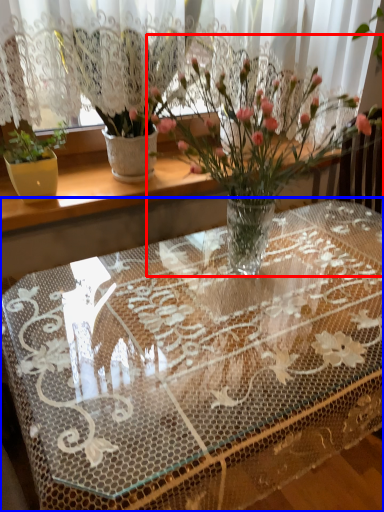
Question: Among these objects, which one is farthest to the camera, houseplant (highlighted by a red box) or table (highlighted by a blue box)?

Choices:
 (A) houseplant
 (B) table

Answer: (A)